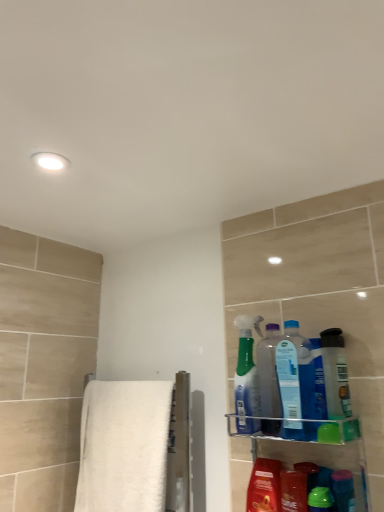
Question: Is green glossy bottle at lower right, which is counted as the second cleaning product, starting from the right, in front of or behind translucent plastic spray bottle at upper right, placed as the third cleaning product when sorted from right to left, in the image?

Choices:
 (A) front
 (B) behind

Answer: (A)

Question: From the image's perspective, is green glossy bottle at lower right, which ranks as the 4th cleaning product in left-to-right order, positioned above or below translucent plastic spray bottle at upper right, placed as the third cleaning product when sorted from right to left?

Choices:
 (A) below
 (B) above

Answer: (A)

Question: Considering the real-world distances, which object is closest to the translucent green spray bottle at upper right, the 1th cleaning product viewed from the left?

Choices:
 (A) translucent plastic bottle at upper right, the second cleaning product positioned from the left
 (B) translucent plastic bottle at right
 (C) translucent plastic spray bottle at upper right, positioned as the first cleaning product in right-to-left order
 (D) white fluffy towel at left
 (E) translucent plastic spray bottle at upper right, the third cleaning product when ordered from left to right

Answer: (A)

Question: Which is nearer to the white fluffy towel at left?

Choices:
 (A) translucent plastic bottle at upper right, which ranks as the 4th cleaning product in right-to-left order
 (B) clear plastic shelf at lower right
 (C) shiny plastic mouthwash at lower right
 (D) green glossy bottle at lower right, which ranks as the 4th cleaning product in left-to-right order
 (E) translucent plastic spray bottle at upper right, positioned as the first cleaning product in right-to-left order

Answer: (B)